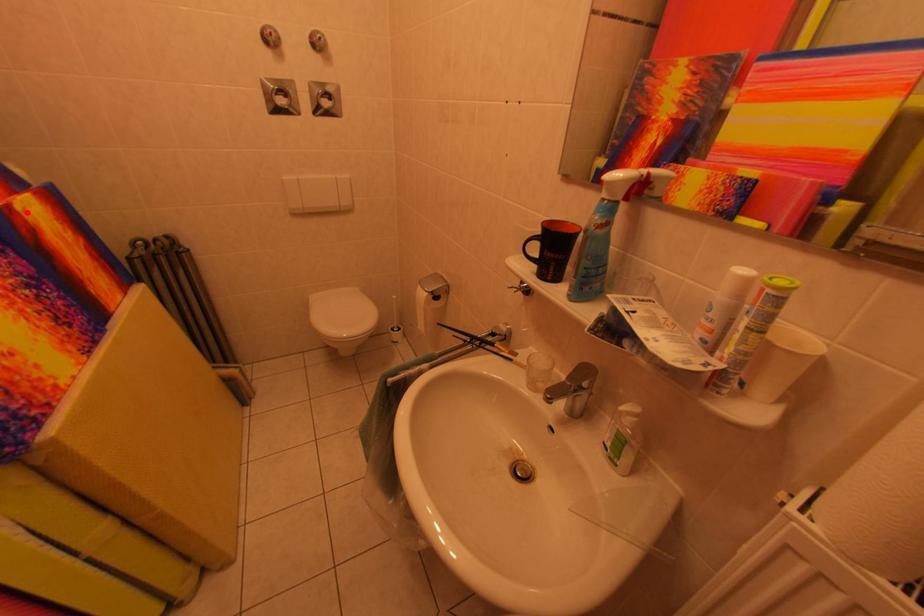
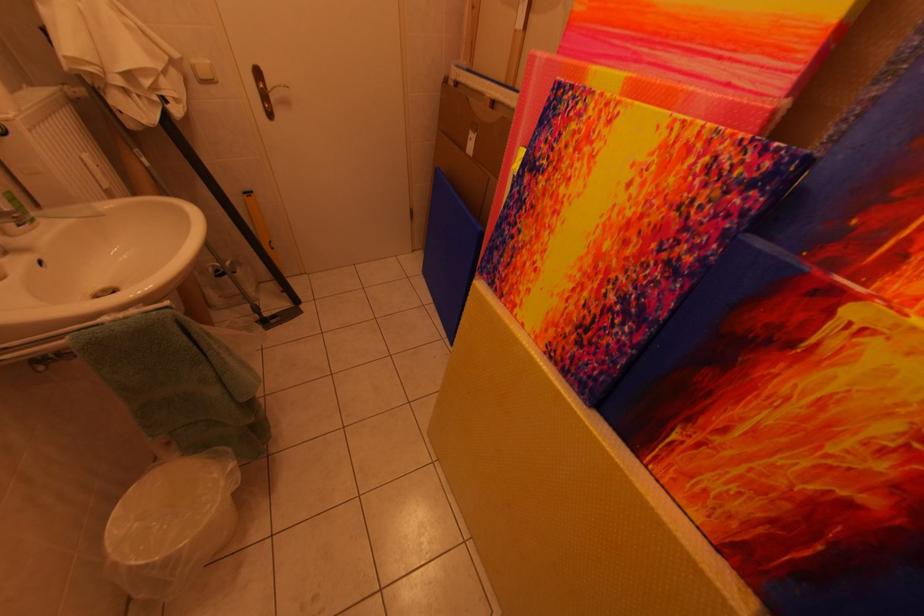
The point at the highlighted location is marked in the first image. Where is the corresponding point in the second image?

(861, 317)